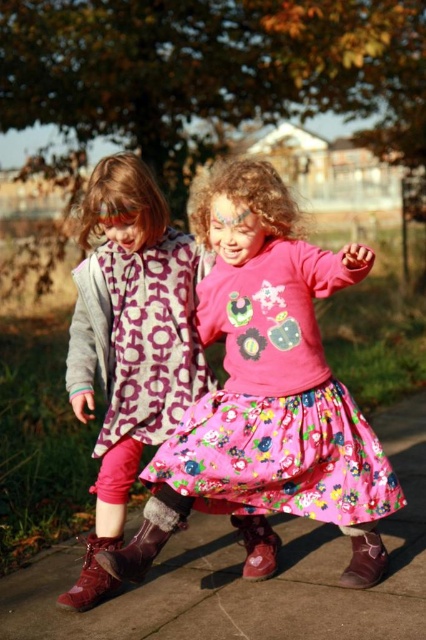
Between point (163, 545) and point (368, 563), which one is positioned in front?

Point (368, 563) is in front.

Between brown suede boot at lower left and brown leather boot at lower right, which one has more height?

Standing taller between the two is brown suede boot at lower left.

You are a GUI agent. You are given a task and a screenshot of the screen. Output one action in this format:
    pyautogui.click(x=<x>, y=<y>)
    Task: Click on the brown suede boot at lower left
    
    Given the screenshot: What is the action you would take?
    pyautogui.click(x=141, y=544)

Where is `brown suede boot at lower left`? This screenshot has height=640, width=426. brown suede boot at lower left is located at coordinates (141, 544).

Who is positioned more to the left, pink floral dress at center or brown suede boot at lower left?

pink floral dress at center is more to the left.

Can you confirm if pink floral dress at center is positioned to the left of brown suede boot at lower left?

Correct, you'll find pink floral dress at center to the left of brown suede boot at lower left.

Identify the location of pink floral dress at center. Image resolution: width=426 pixels, height=640 pixels. (129, 342).

Does floral cotton dress at center appear under pink floral dress at center?

Yes, floral cotton dress at center is below pink floral dress at center.

Is point (267, 509) farther from viewer compared to point (100, 589)?

That is False.

Locate an element on the screen. This screenshot has width=426, height=640. floral cotton dress at center is located at coordinates (276, 401).